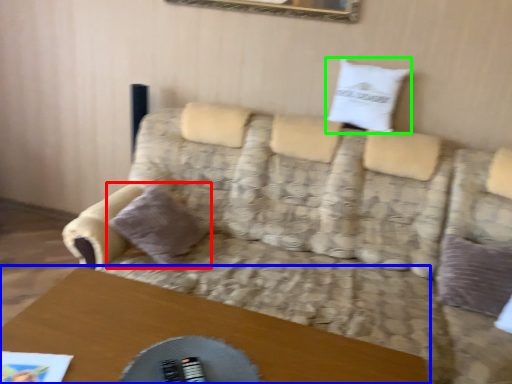
Question: Considering the real-world distances, which object is closest to pillow (highlighted by a red box)? table (highlighted by a blue box) or pillow (highlighted by a green box).

Choices:
 (A) table
 (B) pillow

Answer: (A)